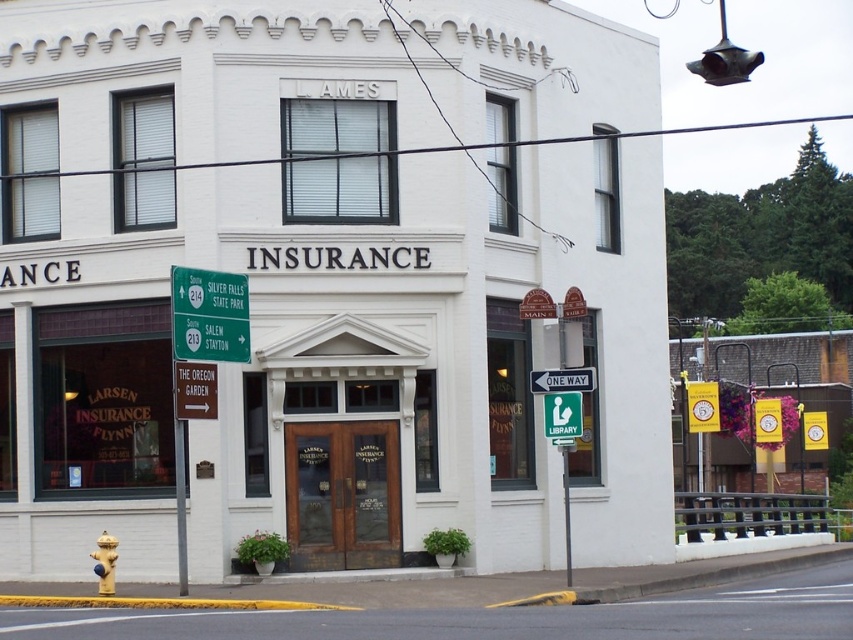
Does metallic pole at lower left have a larger size compared to green plastic street sign at lower right?

Yes, metallic pole at lower left is bigger than green plastic street sign at lower right.

How much distance is there between metallic pole at lower left and green plastic street sign at lower right?

metallic pole at lower left and green plastic street sign at lower right are 5.26 meters apart.

Between point (184, 518) and point (558, 371), which one is positioned in front?

Point (184, 518) is more forward.

This screenshot has height=640, width=853. What are the coordinates of `metallic pole at lower left` in the screenshot? It's located at (180, 504).

Identify the location of white brick building at center. (329, 280).

From the picture: Who is more distant from viewer, [28,321] or [531,374]?

Positioned behind is point [28,321].

Locate an element on the screen. Image resolution: width=853 pixels, height=640 pixels. white brick building at center is located at coordinates (329, 280).

In the scene shown: Can you confirm if white brick building at center is positioned below metallic pole at center?

No, white brick building at center is not below metallic pole at center.

Between point (639, 371) and point (567, 486), which one is positioned in front?

Point (567, 486) is in front.

Where is `white brick building at center`? white brick building at center is located at coordinates (329, 280).